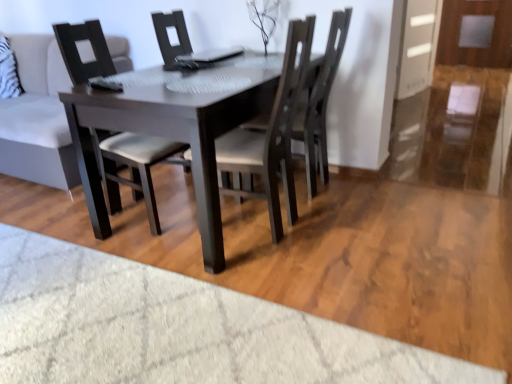
Question: Can you confirm if transparent glass door at right is bigger than dark wood chair at center, which is counted as the second chair, starting from the left?

Choices:
 (A) yes
 (B) no

Answer: (B)

Question: Does transparent glass door at right come behind dark wood chair at center, which is counted as the second chair, starting from the left?

Choices:
 (A) yes
 (B) no

Answer: (A)

Question: Considering the relative sizes of transparent glass door at right and dark wood chair at center, which is counted as the second chair, starting from the right, in the image provided, is transparent glass door at right taller than dark wood chair at center, which is counted as the second chair, starting from the right,?

Choices:
 (A) no
 (B) yes

Answer: (A)

Question: Is transparent glass door at right at the left side of dark wood chair at center, which is counted as the second chair, starting from the left?

Choices:
 (A) yes
 (B) no

Answer: (B)

Question: Is transparent glass door at right positioned far away from dark wood chair at center, which is counted as the second chair, starting from the right?

Choices:
 (A) yes
 (B) no

Answer: (A)

Question: Considering the positions of dark wood chair at center, which is counted as the second chair, starting from the right, and matte black chair at center, the 3th chair in the right-to-left sequence, in the image, is dark wood chair at center, which is counted as the second chair, starting from the right, wider or thinner than matte black chair at center, the 3th chair in the right-to-left sequence,?

Choices:
 (A) thin
 (B) wide

Answer: (B)

Question: Do you think dark wood chair at center, which is counted as the second chair, starting from the right, is within matte black chair at center, which is the 1th chair from left to right, or outside of it?

Choices:
 (A) inside
 (B) outside

Answer: (B)

Question: In the image, is dark wood chair at center, which is counted as the second chair, starting from the left, positioned in front of or behind matte black chair at center, the 3th chair in the right-to-left sequence?

Choices:
 (A) front
 (B) behind

Answer: (A)

Question: Considering the positions of dark wood chair at center, which is counted as the second chair, starting from the left, and matte black chair at center, which is the 1th chair from left to right, in the image, is dark wood chair at center, which is counted as the second chair, starting from the left, taller or shorter than matte black chair at center, which is the 1th chair from left to right,?

Choices:
 (A) short
 (B) tall

Answer: (B)

Question: Based on their positions, is matte black chair at center, which is the 1th chair from left to right, located to the left or right of dark wood chair at center, which is counted as the second chair, starting from the left?

Choices:
 (A) right
 (B) left

Answer: (B)

Question: Is matte black chair at center, the 3th chair in the right-to-left sequence, wider or thinner than dark wood chair at center, which is counted as the second chair, starting from the left?

Choices:
 (A) wide
 (B) thin

Answer: (B)

Question: From a real-world perspective, is matte black chair at center, which is the 1th chair from left to right, positioned above or below dark wood chair at center, which is counted as the second chair, starting from the left?

Choices:
 (A) above
 (B) below

Answer: (B)

Question: Considering the positions of matte black chair at center, the 3th chair in the right-to-left sequence, and dark wood chair at center, which is counted as the second chair, starting from the left, in the image, is matte black chair at center, the 3th chair in the right-to-left sequence, taller or shorter than dark wood chair at center, which is counted as the second chair, starting from the left,?

Choices:
 (A) short
 (B) tall

Answer: (A)

Question: Is light gray fabric couch at upper left wider or thinner than dark wood chair at center, which is counted as the 3th chair, starting from the left?

Choices:
 (A) wide
 (B) thin

Answer: (A)

Question: Considering the positions of light gray fabric couch at upper left and dark wood chair at center, which is counted as the 3th chair, starting from the left, in the image, is light gray fabric couch at upper left taller or shorter than dark wood chair at center, which is counted as the 3th chair, starting from the left,?

Choices:
 (A) short
 (B) tall

Answer: (A)